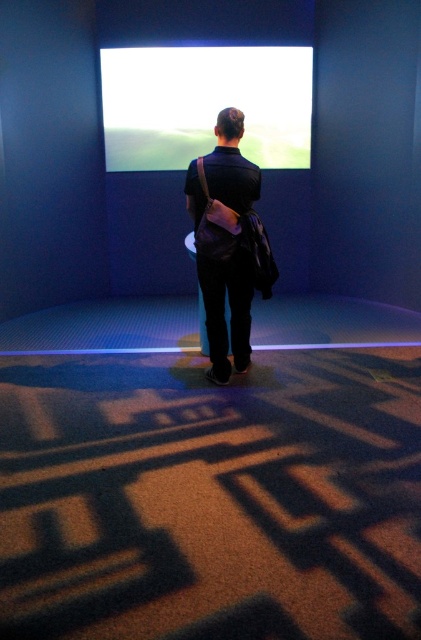
You are navigating through a room with two points marked on the floor. You are currently at point [199,278] and want to reach point [138,93]. Can you move directly towards it without going around any obstacles?

Yes, you can move directly towards point [138,93] because it is behind point [199,278], meaning there are no obstacles blocking the path between them.

You are a person in the room. You want to look at the screen. Where should you walk to? Please answer with coordinates in the format of point like point (x=205, y=104).

The point (x=205, y=104) marks the white glossy screen at upper center, so you should walk to point (x=205, y=104) to look at the screen.

You are a technician trying to adjust the position of the white glossy screen at upper center. The system requires you to input the coordinates to center it. What are the coordinates you should enter?

The white glossy screen at upper center is already positioned at point [205,104], so you should enter these coordinates to center it.